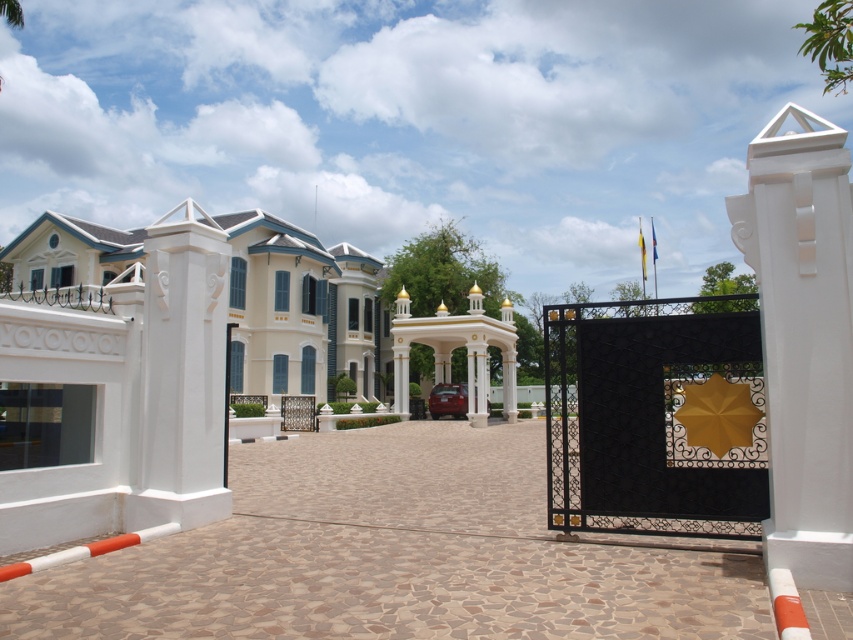
You are standing at the entrance of the estate and want to take a photo of the white smooth column at center. If your camera has a maximum focus range of 7 meters, will you be able to capture the column clearly?

The white smooth column at center and camera are 7.83 meters apart from each other, so the camera cannot focus on the column clearly as it is beyond the 7 meters range.

You are a photographer planning to take a photo of the shiny red car at center. To ensure the white smooth column at center doesn not block the view, where should you position yourself relative to the car?

The white smooth column at center is taller than the shiny red car at center, so positioning yourself behind the car will keep the column from blocking the view.